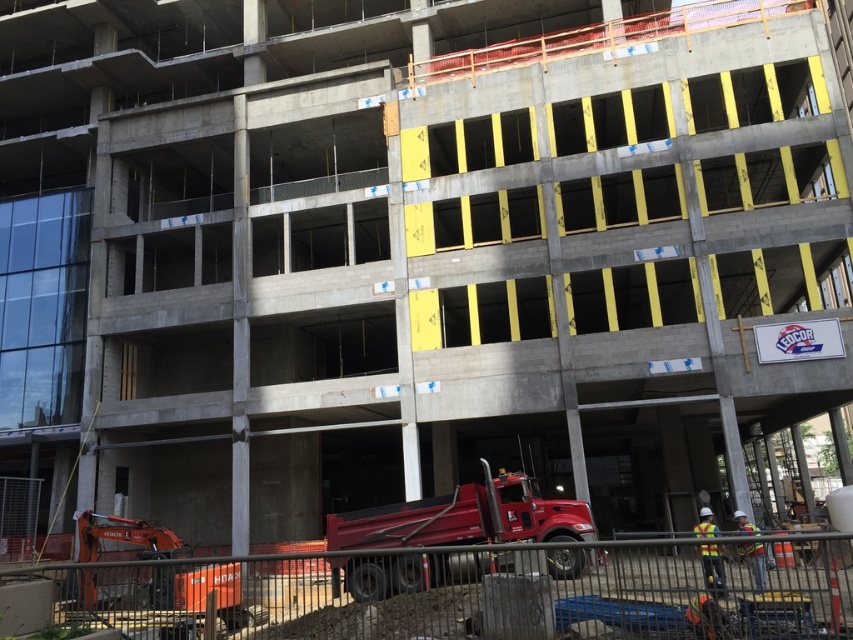
Between shiny red truck at center and reflective yellow safety vest at lower center, which one is positioned lower?

shiny red truck at center

Is point (447, 499) closer to viewer compared to point (722, 573)?

No, (447, 499) is further to viewer.

Is point (521, 513) positioned after point (706, 580)?

Yes, point (521, 513) is farther from viewer.

At what (x,y) coordinates should I click in order to perform the action: click on shiny red truck at center. Please return your answer as a coordinate pair (x, y). Looking at the image, I should click on (465, 516).

Is point (552, 548) positioned in front of point (762, 580)?

No, it is not.

Is shiny red truck at center to the left of reflective safety vest at center from the viewer's perspective?

Yes, shiny red truck at center is to the left of reflective safety vest at center.

Is point (415, 580) positioned in front of point (740, 525)?

Yes, point (415, 580) is in front of point (740, 525).

In order to click on shiny red truck at center in this screenshot , I will do `click(465, 516)`.

Can you confirm if reflective yellow safety vest at lower center is shorter than reflective safety vest at center?

Incorrect, reflective yellow safety vest at lower center's height does not fall short of reflective safety vest at center's.

Does point (701, 513) lie in front of point (753, 577)?

No, (701, 513) is further to viewer.

I want to click on reflective yellow safety vest at lower center, so click(712, 568).